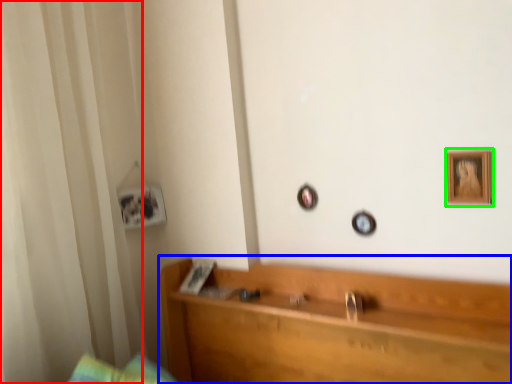
Question: Which object is the closest to the curtain (highlighted by a red box)? Choose among these: furniture (highlighted by a blue box) or picture frame (highlighted by a green box).

Choices:
 (A) furniture
 (B) picture frame

Answer: (A)